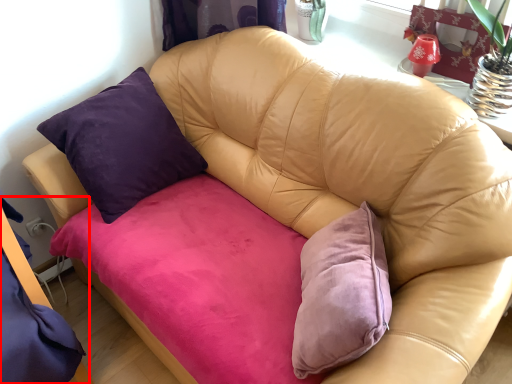
Question: From the image's perspective, where is bed frame (annotated by the red box) located in relation to swivel chair in the image?

Choices:
 (A) above
 (B) below

Answer: (B)